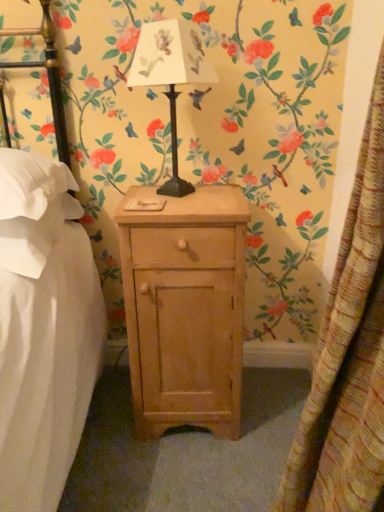
This screenshot has width=384, height=512. I want to click on free space in front of metallic black table lamp at center, so [x=186, y=210].